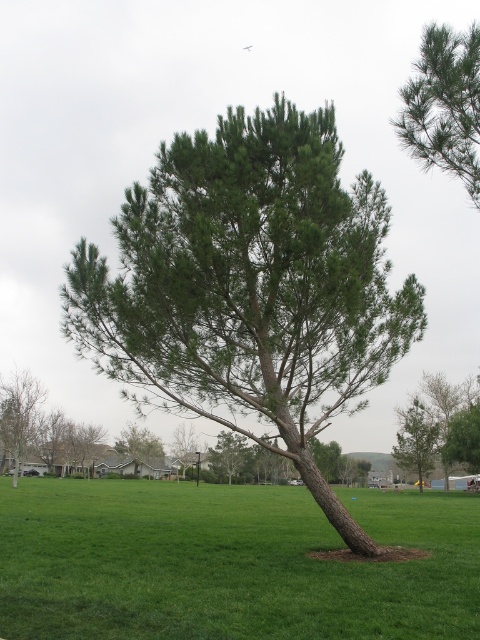
You are standing in the grassy field looking at the pine tree. There are two points marked on the tree. One is at coordinate point [419,291] and the other is at point [152,444]. Which point is closer to your eyes?

Point [419,291] is closer to the camera than point [152,444].

You are a landscape architect designing a garden and need to place both the green leafy tree at lower right and the green matte tree at lower right. Which tree has a larger width?

The green leafy tree at lower right might be wider than green matte tree at lower right, so the green leafy tree at lower right likely has a larger width.